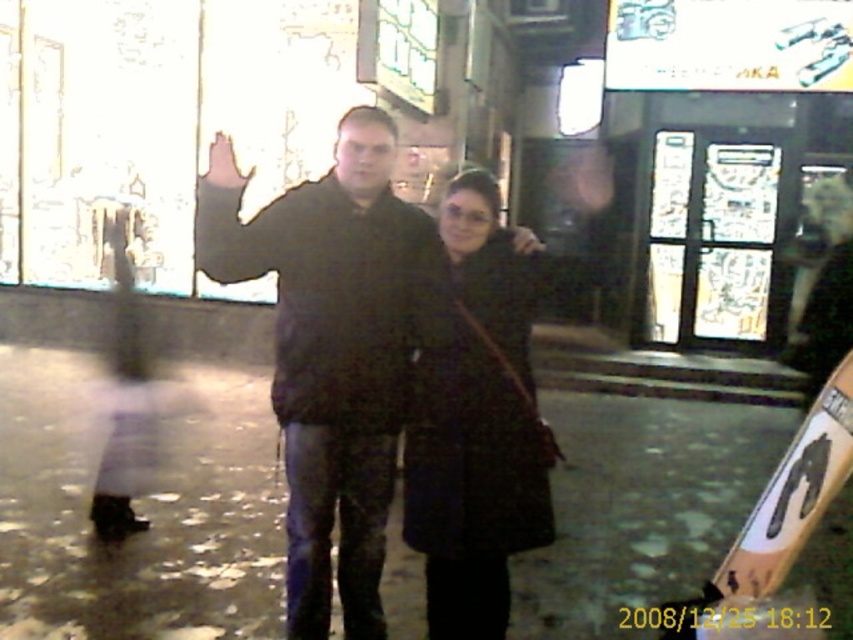
You are standing on the cobblestone street and want to take a photo of the two people. You notice two points marked in the image. The first point is at coordinates point (335, 497) and the second point is at point (485, 275). Which point is closer to the camera?

Point (485, 275) is closer to the camera because it is in front of point (335, 497), which is behind it.

You are a photographer trying to capture a photo of the two people in the scene. You notice the dark matte coat at center and the dark brown textured coat at center. Which coat should you focus on first if you want to ensure both are in sharp focus, considering their positions?

The dark matte coat at center is above the dark brown textured coat at center, so focusing on the dark matte coat at center first will ensure both coats are in sharp focus as they are stacked vertically.